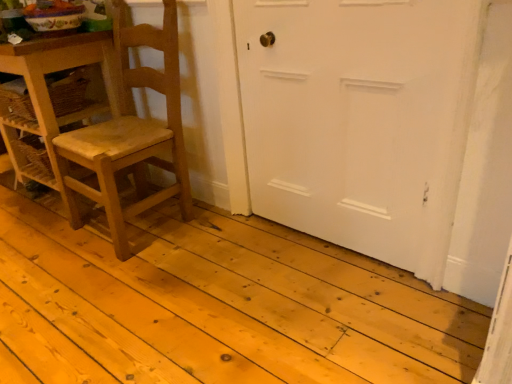
Question: Is natural wood floor at center closer to the viewer compared to wooden table at left?

Choices:
 (A) yes
 (B) no

Answer: (A)

Question: Is natural wood floor at center positioned with its back to wooden table at left?

Choices:
 (A) no
 (B) yes

Answer: (A)

Question: Is natural wood floor at center shorter than wooden table at left?

Choices:
 (A) yes
 (B) no

Answer: (A)

Question: From a real-world perspective, is natural wood floor at center under wooden table at left?

Choices:
 (A) yes
 (B) no

Answer: (A)

Question: Is wooden table at left surrounded by natural wood floor at center?

Choices:
 (A) yes
 (B) no

Answer: (B)

Question: From a real-world perspective, is white matte door at center positioned above or below wooden table at left?

Choices:
 (A) above
 (B) below

Answer: (A)

Question: Looking at their shapes, would you say white matte door at center is wider or thinner than wooden table at left?

Choices:
 (A) wide
 (B) thin

Answer: (B)

Question: Considering the positions of point (309, 49) and point (51, 180), is point (309, 49) closer or farther from the camera than point (51, 180)?

Choices:
 (A) farther
 (B) closer

Answer: (B)

Question: Visually, is white matte door at center positioned to the left or to the right of wooden table at left?

Choices:
 (A) right
 (B) left

Answer: (A)

Question: Choose the correct answer: Is natural wood floor at center inside wooden chair at left or outside it?

Choices:
 (A) outside
 (B) inside

Answer: (A)

Question: Does point (310, 256) appear closer or farther from the camera than point (177, 140)?

Choices:
 (A) closer
 (B) farther

Answer: (A)

Question: Considering the positions of natural wood floor at center and wooden chair at left in the image, is natural wood floor at center taller or shorter than wooden chair at left?

Choices:
 (A) tall
 (B) short

Answer: (B)

Question: Considering the positions of natural wood floor at center and wooden chair at left in the image, is natural wood floor at center bigger or smaller than wooden chair at left?

Choices:
 (A) small
 (B) big

Answer: (B)

Question: Considering the positions of natural wood floor at center and wooden table at left in the image, is natural wood floor at center taller or shorter than wooden table at left?

Choices:
 (A) tall
 (B) short

Answer: (B)

Question: Relative to wooden table at left, is natural wood floor at center in front or behind?

Choices:
 (A) front
 (B) behind

Answer: (A)